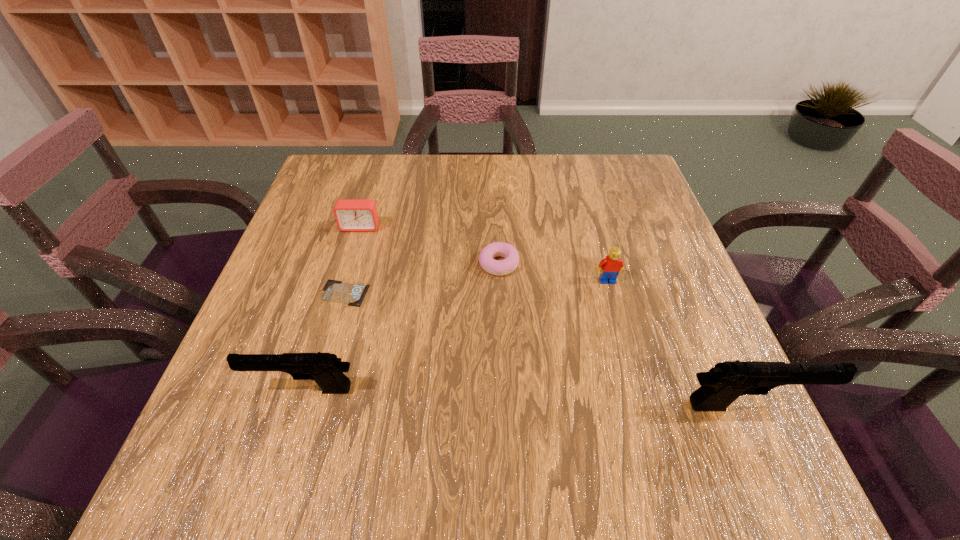
You are a GUI agent. You are given a task and a screenshot of the screen. Output one action in this format:
    pyautogui.click(x=<x>, y=<y>)
    Task: Click on the object positioned at the near right corner
    
    Given the screenshot: What is the action you would take?
    pyautogui.click(x=720, y=386)

Locate an element on the screen. vacant space at the far edge of the desktop is located at coordinates (519, 197).

You are a GUI agent. You are given a task and a screenshot of the screen. Output one action in this format:
    pyautogui.click(x=<x>, y=<y>)
    Task: Click on the vacant space at the near edge of the desktop
    
    Given the screenshot: What is the action you would take?
    pyautogui.click(x=635, y=408)

Image resolution: width=960 pixels, height=540 pixels. What are the coordinates of `vacant area at the left edge` in the screenshot? It's located at (294, 227).

Image resolution: width=960 pixels, height=540 pixels. In order to click on vacant space at the right edge of the desktop in this screenshot , I will do `click(596, 214)`.

Find the location of `free point at the far left corner`. free point at the far left corner is located at coordinates (324, 166).

Where is `vacant space at the near left corner of the desktop`? This screenshot has width=960, height=540. vacant space at the near left corner of the desktop is located at coordinates (311, 382).

In the image, there is a desktop. Identify the location of vacant region at the far right corner. (610, 178).

The height and width of the screenshot is (540, 960). In order to click on free point between the second nearest object and the pastry in this screenshot , I will do `click(401, 327)`.

Identify the location of empty space that is in between the fifth object from left to right and the shorter pistol. (456, 335).